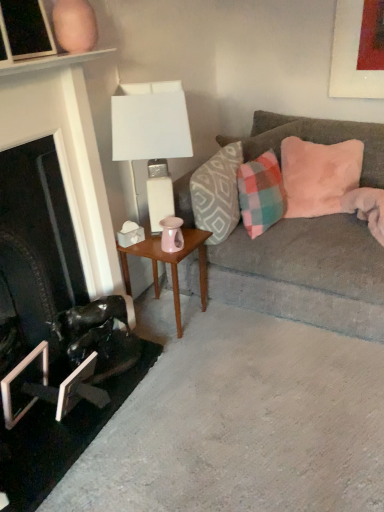
I want to click on vacant space in front of shiny black swivel chair at lower left, so click(92, 408).